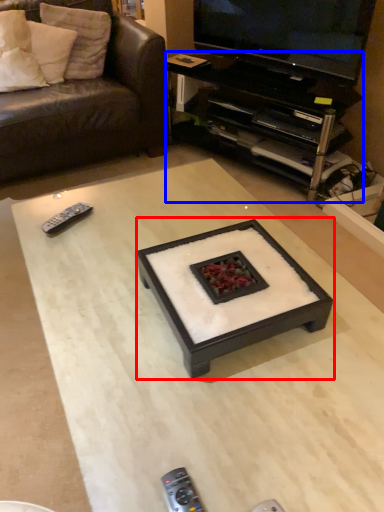
Question: Which object appears farthest to the camera in this image, coffee table (highlighted by a red box) or desk (highlighted by a blue box)?

Choices:
 (A) coffee table
 (B) desk

Answer: (B)